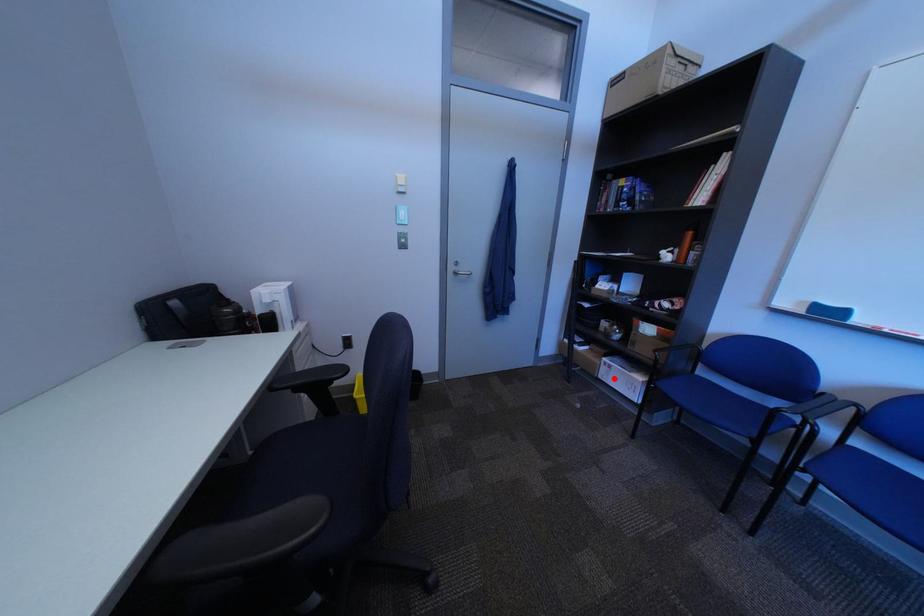
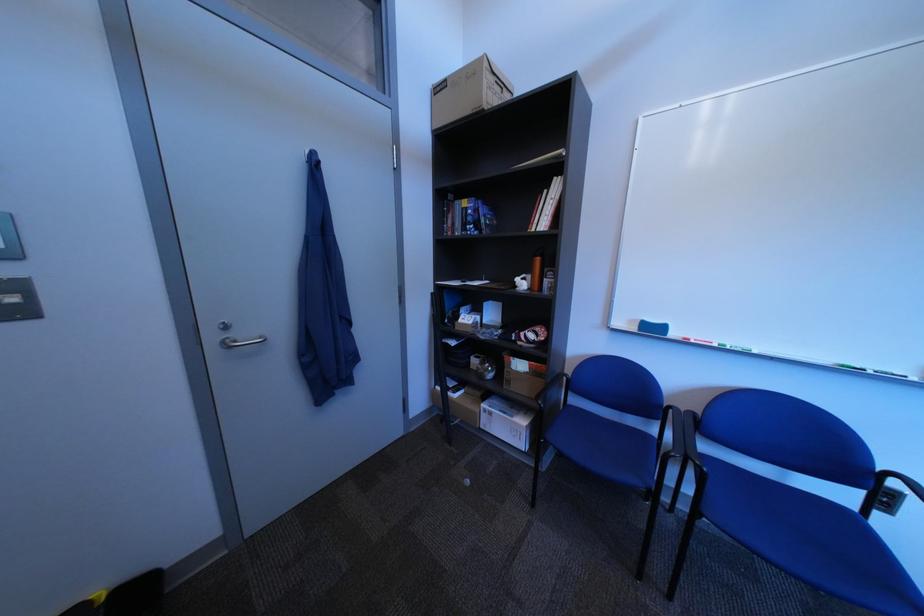
Question: I am providing you with two images of the same scene from different viewpoints. A red point is shown in image1. For the corresponding object point in image2, is it positioned nearer or farther from the camera?

Choices:
 (A) Nearer
 (B) Farther

Answer: (B)